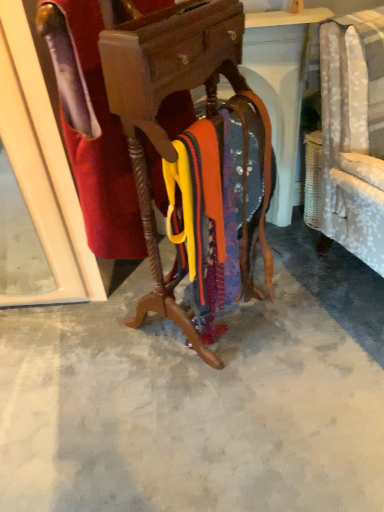
Question: Considering their positions, is velvet red robe at center located in front of or behind wooden coat rack at center?

Choices:
 (A) front
 (B) behind

Answer: (B)

Question: Do you think velvet red robe at center is within wooden coat rack at center, or outside of it?

Choices:
 (A) inside
 (B) outside

Answer: (A)

Question: Which object is the closest to the smooth concrete floor at center?

Choices:
 (A) wooden coat rack at center
 (B) velvet red robe at center

Answer: (A)

Question: Based on their relative distances, which object is nearer to the wooden coat rack at center?

Choices:
 (A) velvet red robe at center
 (B) smooth concrete floor at center

Answer: (A)